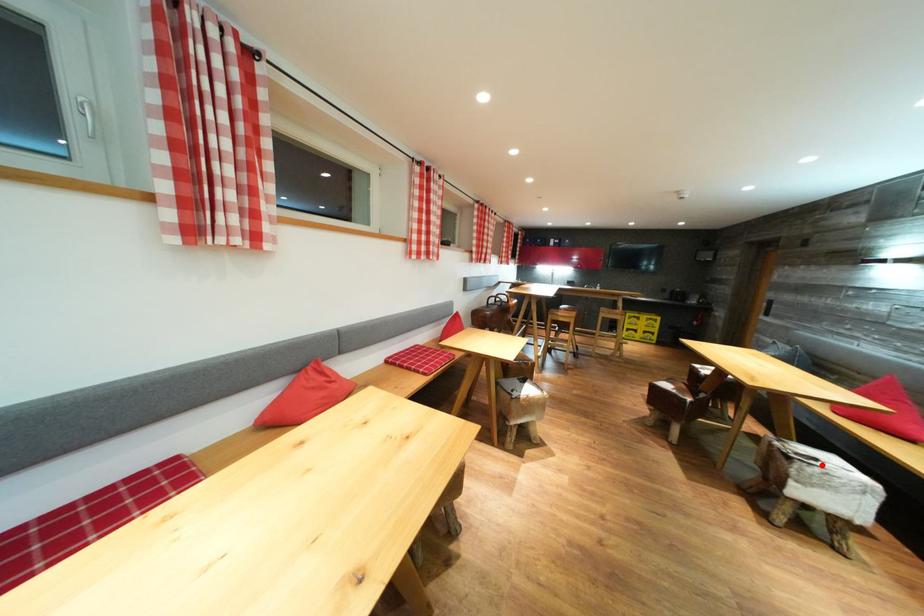
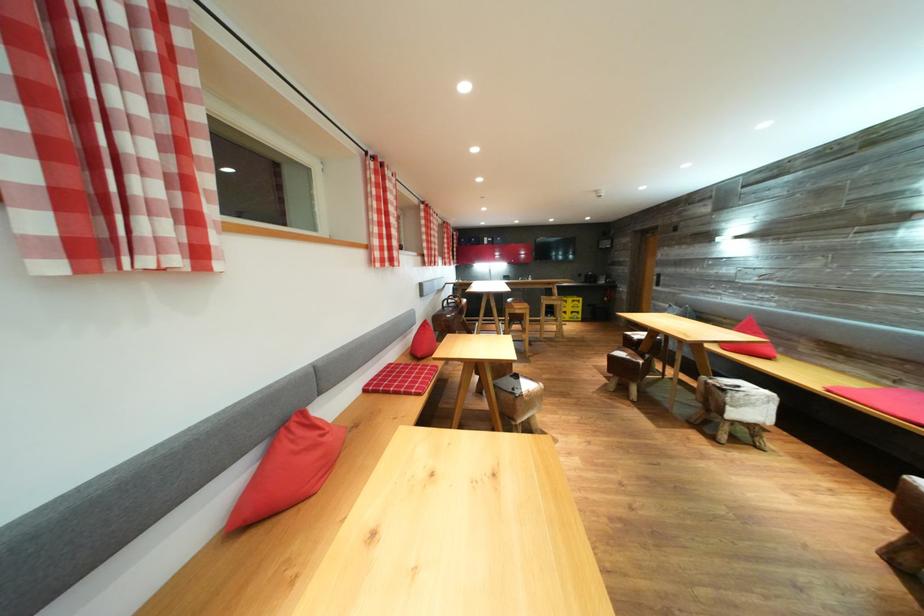
Question: I am providing you with two images of the same scene from different viewpoints. In image1, a red point is highlighted. Considering the same 3D point in image2, which of the following is correct?

Choices:
 (A) It is closer
 (B) It is farther

Answer: (B)